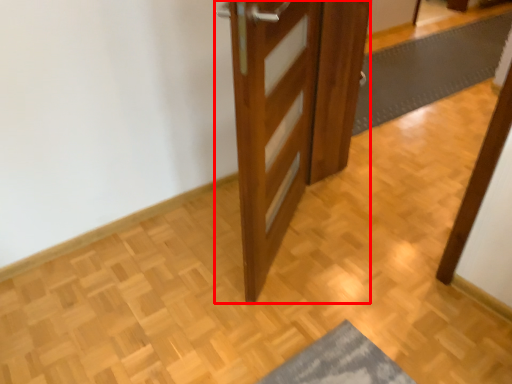
Question: From the image's perspective, what is the correct spatial relationship of door (annotated by the red box) in relation to bath mat?

Choices:
 (A) below
 (B) above

Answer: (A)